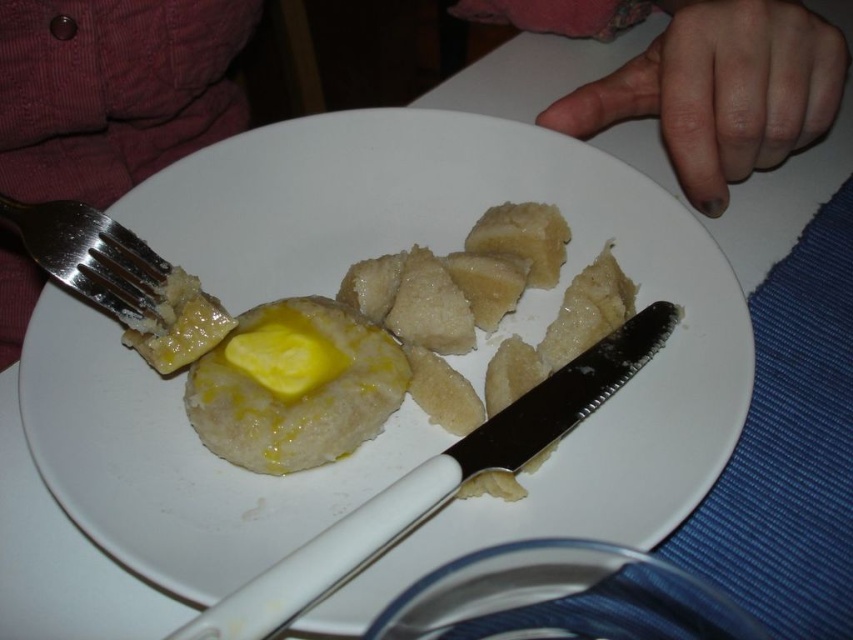
Does point (491, 244) come farther from viewer compared to point (500, 426)?

Yes, point (491, 244) is farther from viewer.

Who is higher up, yellow buttery roll at center or white plastic knife at center?

yellow buttery roll at center is above.

Which is behind, point (279, 332) or point (529, 442)?

Positioned behind is point (279, 332).

Where is `yellow buttery roll at center`? The width and height of the screenshot is (853, 640). yellow buttery roll at center is located at coordinates pyautogui.click(x=416, y=336).

Does matte yellow butter at center appear under yellow buttery mashed potato at center?

Actually, matte yellow butter at center is above yellow buttery mashed potato at center.

Is point (51, 148) less distant than point (264, 368)?

No, it is not.

Locate an element on the screen. The width and height of the screenshot is (853, 640). matte yellow butter at center is located at coordinates (113, 90).

Who is shorter, yellow buttery roll at center or silver metallic fork at upper left?

Standing shorter between the two is silver metallic fork at upper left.

Who is more forward, (490, 292) or (99, 278)?

Point (99, 278)

Where is `yellow buttery roll at center`? Image resolution: width=853 pixels, height=640 pixels. yellow buttery roll at center is located at coordinates (416, 336).